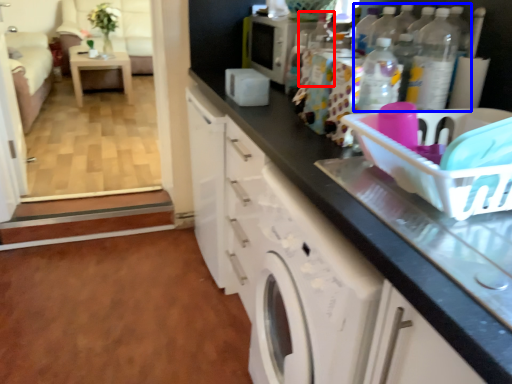
Question: Which object is closer to the camera taking this photo, bottle (highlighted by a red box) or bottle (highlighted by a blue box)?

Choices:
 (A) bottle
 (B) bottle

Answer: (B)